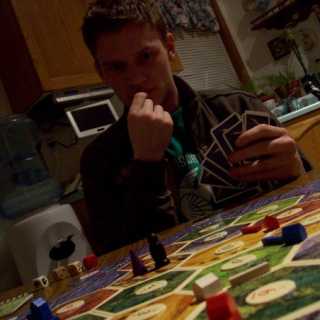
Locate an element on the screen. tile is located at coordinates (124, 309).